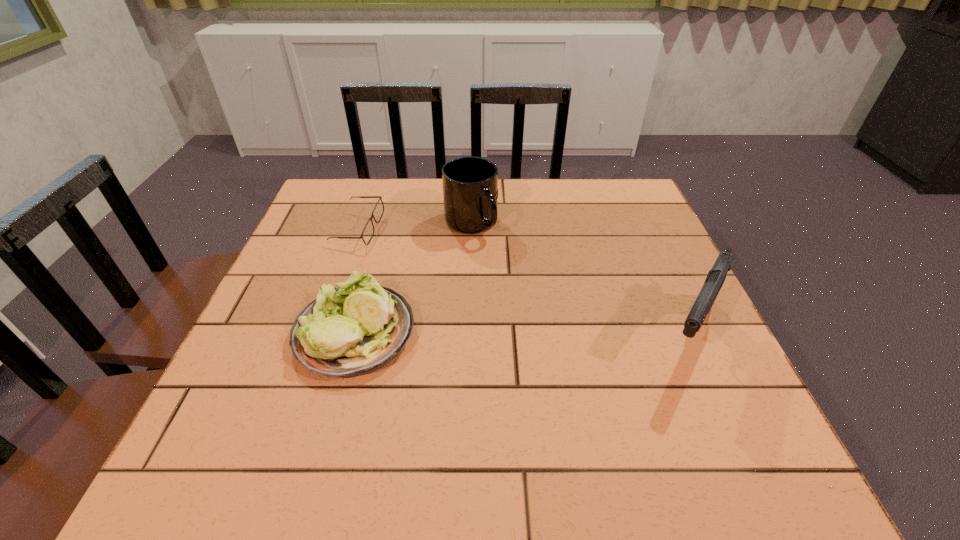
Find the location of a particular element. vacant spot on the desktop that is between the lettuce and the gun and is positioned with the handle on the side of the mug is located at coordinates (533, 335).

You are a GUI agent. You are given a task and a screenshot of the screen. Output one action in this format:
    pyautogui.click(x=<x>, y=<y>)
    Task: Click on the vacant space on the desktop that is between the lettuce and the gun and is positioned with the lenses facing outward on the spectacles
    The image size is (960, 540).
    Given the screenshot: What is the action you would take?
    pyautogui.click(x=562, y=335)